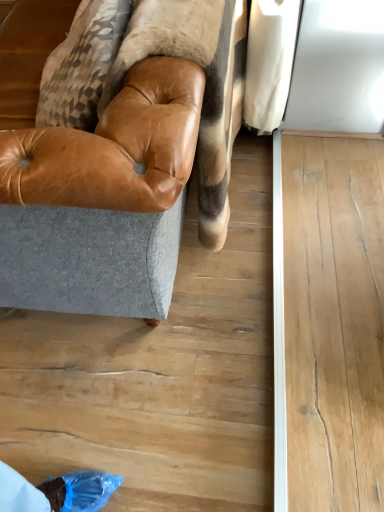
The image size is (384, 512). What do you see at coordinates (334, 322) in the screenshot? I see `wooden plank at lower right` at bounding box center [334, 322].

Image resolution: width=384 pixels, height=512 pixels. I want to click on wooden plank at lower right, so click(x=334, y=322).

Identify the location of wooden plank at lower right. (334, 322).